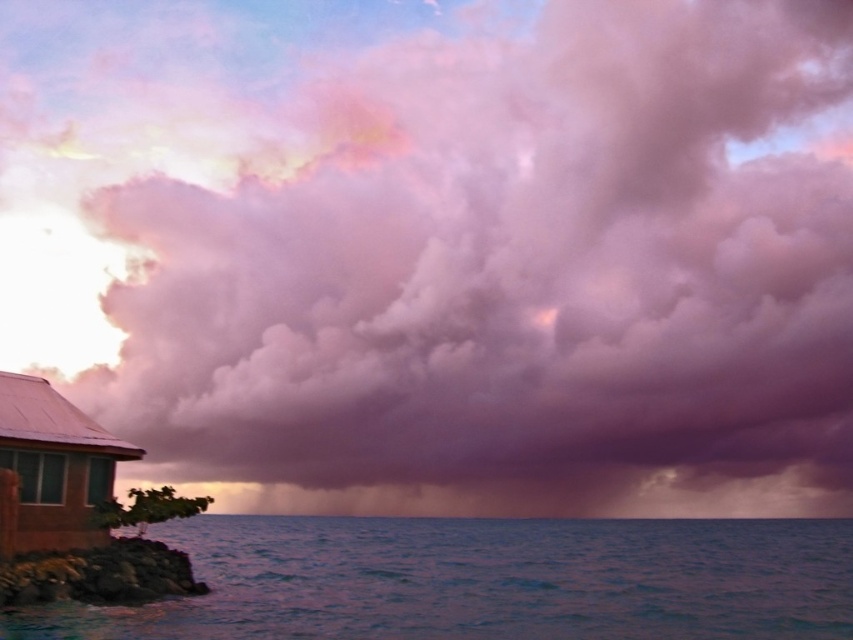
At what (x,y) coordinates should I click in order to perform the action: click on blue water at lower left. Please return your answer as a coordinate pair (x, y). Image resolution: width=853 pixels, height=640 pixels. Looking at the image, I should click on (486, 580).

Is the position of blue water at lower left less distant than that of brown corrugated metal hut at lower left?

That is True.

Locate an element on the screen. The image size is (853, 640). blue water at lower left is located at coordinates (486, 580).